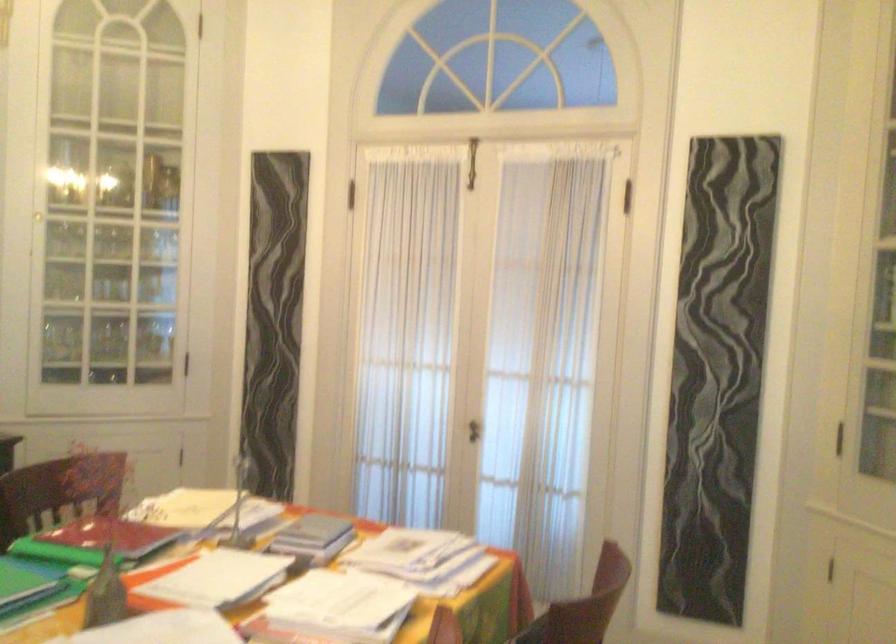
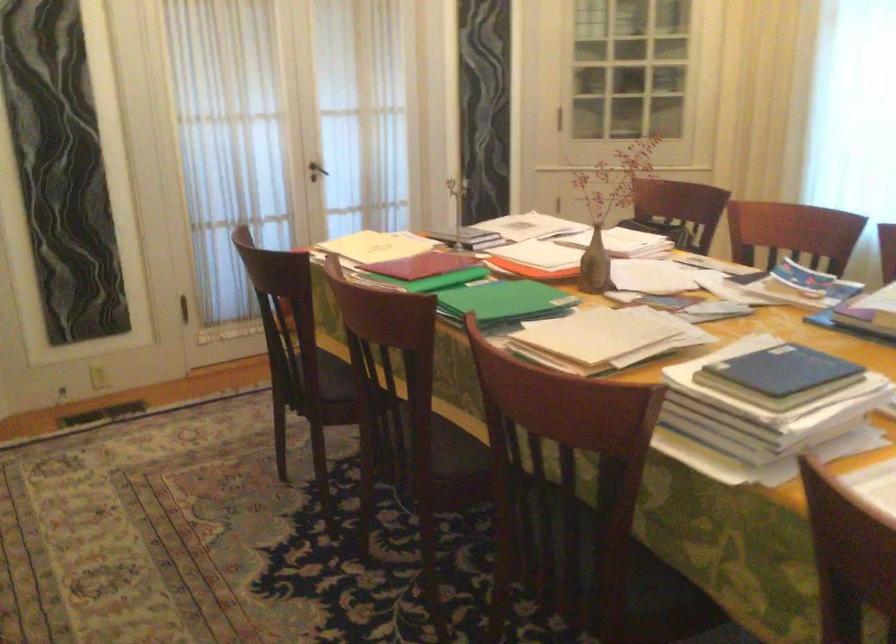
Locate, in the second image, the point that corresponds to (x=467, y=413) in the first image.

(316, 171)